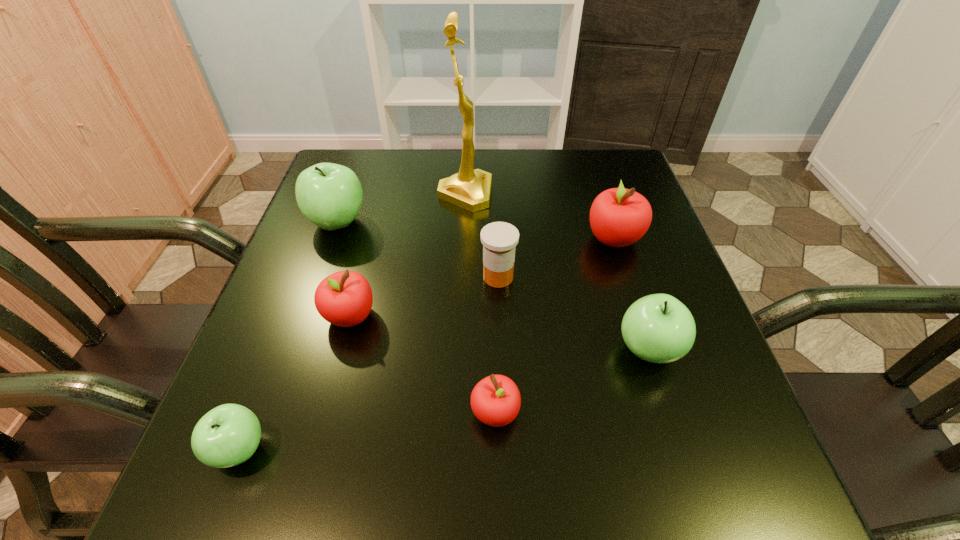
The image size is (960, 540). Identify the location of vacant region located 0.350m on the label of the orange medicine. (308, 277).

In order to click on vacant space located 0.320m on the label of the orange medicine in this screenshot , I will do `click(323, 277)`.

Locate an element on the screen. Image resolution: width=960 pixels, height=540 pixels. vacant region located on the left of the fourth apple from left to right is located at coordinates (426, 412).

You are a GUI agent. You are given a task and a screenshot of the screen. Output one action in this format:
    pyautogui.click(x=<x>, y=<y>)
    Task: Click on the free space located on the back of the smallest green apple
    
    Given the screenshot: What is the action you would take?
    pyautogui.click(x=265, y=382)

Locate an element on the screen. This screenshot has width=960, height=540. object that is at the far edge is located at coordinates tap(470, 189).

The width and height of the screenshot is (960, 540). In order to click on object situated at the near edge in this screenshot , I will do `click(228, 435)`.

Find the location of a particular element. Image resolution: width=960 pixels, height=540 pixels. object positioned at the near left corner is located at coordinates (228, 435).

The height and width of the screenshot is (540, 960). In the image, there is a desktop. What are the coordinates of `free space at the far edge` in the screenshot? It's located at (519, 200).

You are a GUI agent. You are given a task and a screenshot of the screen. Output one action in this format:
    pyautogui.click(x=<x>, y=<y>)
    Task: Click on the free space at the near edge of the desktop
    This screenshot has height=540, width=960.
    Given the screenshot: What is the action you would take?
    pyautogui.click(x=437, y=514)

Identify the location of vacant space at the left edge of the desktop. (332, 237).